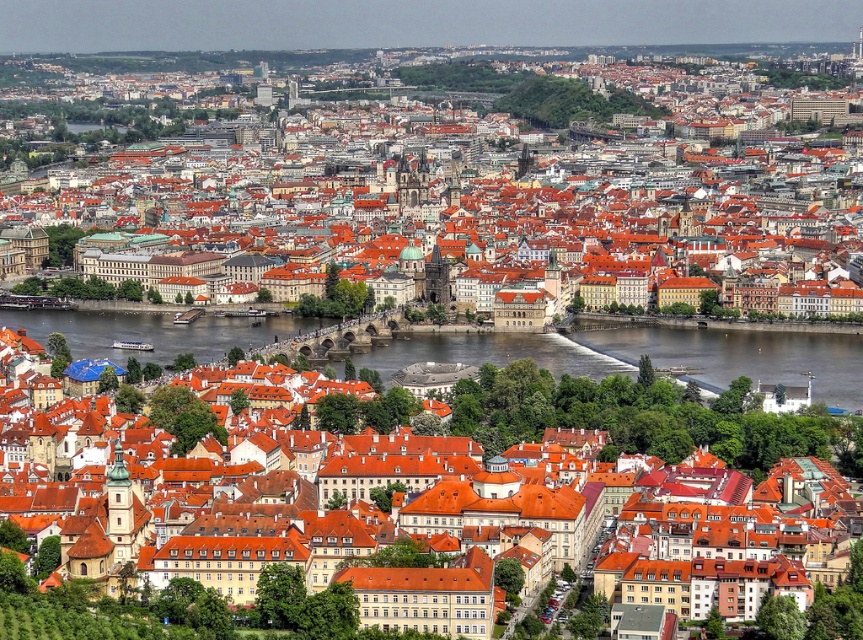
Can you confirm if orange tiled roofs at center is wider than brown water at center?

Indeed, orange tiled roofs at center has a greater width compared to brown water at center.

Identify the location of orange tiled roofs at center. (490, 157).

Which is behind, point (426, 356) or point (338, 369)?

Positioned behind is point (426, 356).

Does matte orange rooftops at center have a greater width compared to brown water at center?

Incorrect, matte orange rooftops at center's width does not surpass brown water at center's.

Is point (835, 378) positioned before point (706, 378)?

No, (835, 378) is behind (706, 378).

This screenshot has height=640, width=863. I want to click on matte orange rooftops at center, so click(650, 390).

Find the location of `orange tiled roofs at center`. orange tiled roofs at center is located at coordinates (490, 157).

Does orange tiled roofs at center have a lesser width compared to matte orange rooftops at center?

No, orange tiled roofs at center is not thinner than matte orange rooftops at center.

Is point (635, 152) closer to viewer compared to point (679, 408)?

No, it is not.

I want to click on orange tiled roofs at center, so click(490, 157).